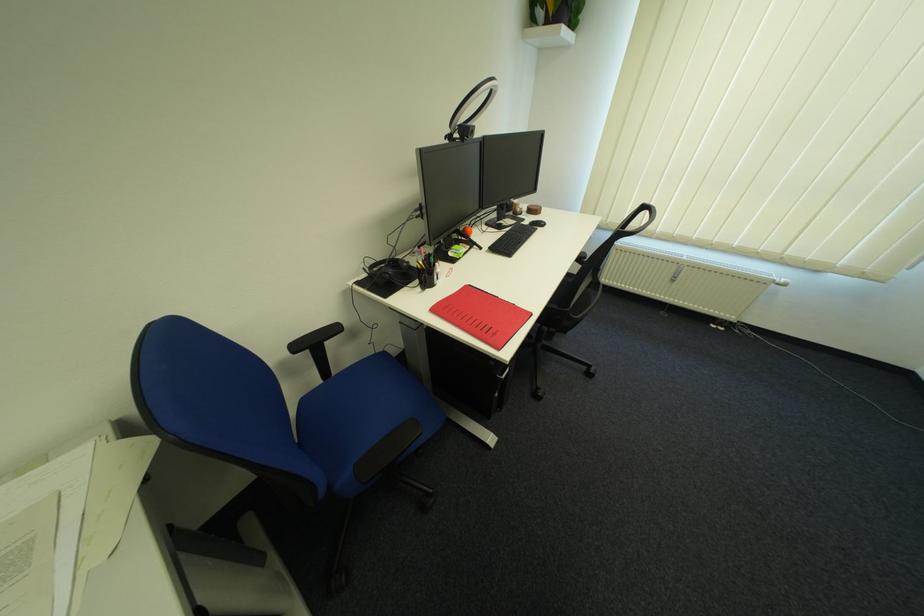
Identify the location of red folder. This screenshot has width=924, height=616. (481, 315).